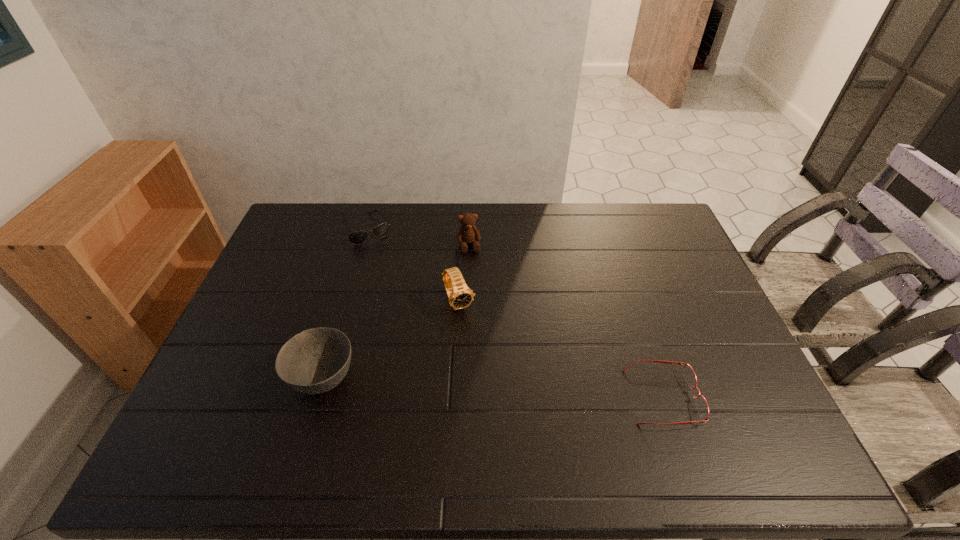
I want to click on spectacles that is at the near edge, so click(689, 374).

The height and width of the screenshot is (540, 960). Identify the location of object situated at the right edge. (689, 374).

The image size is (960, 540). Find the location of `object that is at the near right corner`. object that is at the near right corner is located at coordinates (689, 374).

In the image, there is a desktop. Identify the location of vacant space at the far edge. The height and width of the screenshot is (540, 960). (382, 218).

The width and height of the screenshot is (960, 540). Identify the location of vacant space at the near edge of the desktop. (336, 416).

You are a GUI agent. You are given a task and a screenshot of the screen. Output one action in this format:
    pyautogui.click(x=<x>, y=<y>)
    Task: Click on the vacant space at the left edge of the desktop
    The image size is (960, 540).
    Given the screenshot: What is the action you would take?
    pyautogui.click(x=307, y=275)

Image resolution: width=960 pixels, height=540 pixels. In order to click on blank space at the right edge in this screenshot , I will do `click(709, 318)`.

Where is `vacant space at the far left corner`? The image size is (960, 540). vacant space at the far left corner is located at coordinates (298, 224).

Find the location of a particular element. Image resolution: width=960 pixels, height=540 pixels. free spot between the teddy bear and the sunglasses is located at coordinates (419, 238).

At what (x,y) coordinates should I click in order to perform the action: click on unoccupied position between the teddy bear and the third farthest object. Please return your answer as a coordinate pair (x, y). Looking at the image, I should click on (464, 274).